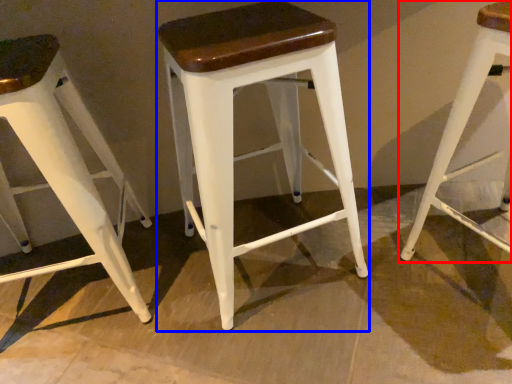
Question: Which of the following is the farthest to the observer, stool (highlighted by a red box) or stool (highlighted by a blue box)?

Choices:
 (A) stool
 (B) stool

Answer: (B)